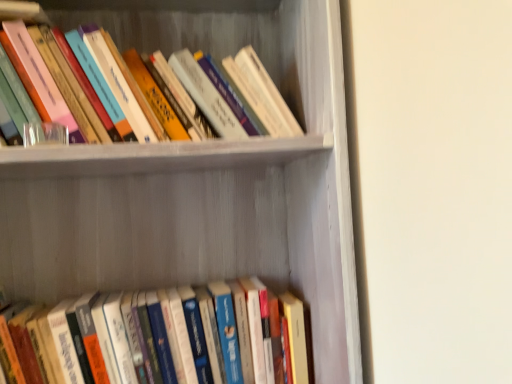
Question: Looking at the image, does white matte bookshelf at upper center seem bigger or smaller compared to hardcover books at upper left, which is the 2th book from bottom to top?

Choices:
 (A) big
 (B) small

Answer: (A)

Question: Is point (270, 31) closer or farther from the camera than point (202, 29)?

Choices:
 (A) farther
 (B) closer

Answer: (A)

Question: Estimate the real-world distances between objects in this image. Which object is closer to the hardcover books at lower center, placed as the second book when sorted from top to bottom?

Choices:
 (A) hardcover books at upper left, which is the 2th book from bottom to top
 (B) white matte bookshelf at upper center

Answer: (B)

Question: Which is nearer to the hardcover books at upper left, which is the 2th book from bottom to top?

Choices:
 (A) white matte bookshelf at upper center
 (B) hardcover books at lower center, placed as the second book when sorted from top to bottom

Answer: (A)